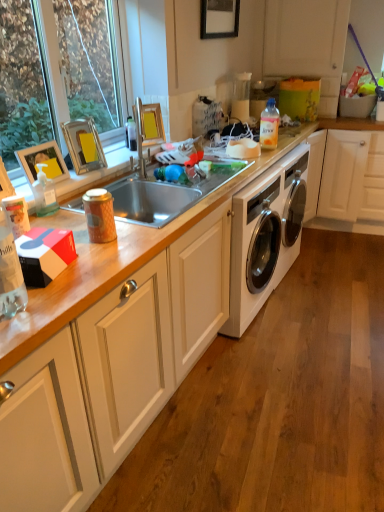
Question: Is the depth of yellow cardboard picture frame at upper center, which is counted as the 2th picture frame, starting from the right, less than that of clear glass window at upper left?

Choices:
 (A) no
 (B) yes

Answer: (A)

Question: Is yellow cardboard picture frame at upper center, acting as the second picture frame starting from the top, facing away from clear glass window at upper left?

Choices:
 (A) yes
 (B) no

Answer: (A)

Question: From a real-world perspective, is yellow cardboard picture frame at upper center, marked as the 3th picture frame in a bottom-to-top arrangement, positioned under clear glass window at upper left based on gravity?

Choices:
 (A) yes
 (B) no

Answer: (A)

Question: Does yellow cardboard picture frame at upper center, marked as the 3th picture frame in a bottom-to-top arrangement, have a lesser width compared to clear glass window at upper left?

Choices:
 (A) yes
 (B) no

Answer: (B)

Question: Is the surface of yellow cardboard picture frame at upper center, which is counted as the 2th picture frame, starting from the right, in direct contact with clear glass window at upper left?

Choices:
 (A) yes
 (B) no

Answer: (B)

Question: Is metallic silver picture frame at upper left, which is the 4th picture frame in top-to-bottom order, spatially inside black matte picture frame at upper center, the fourth picture frame in the left-to-right sequence, or outside of it?

Choices:
 (A) outside
 (B) inside

Answer: (A)

Question: Does point (56, 178) appear closer or farther from the camera than point (236, 34)?

Choices:
 (A) farther
 (B) closer

Answer: (B)

Question: Considering the positions of metallic silver picture frame at upper left, the fourth picture frame in the right-to-left sequence, and black matte picture frame at upper center, the 1th picture frame from the right, in the image, is metallic silver picture frame at upper left, the fourth picture frame in the right-to-left sequence, bigger or smaller than black matte picture frame at upper center, the 1th picture frame from the right,?

Choices:
 (A) small
 (B) big

Answer: (A)

Question: In the image, is metallic silver picture frame at upper left, marked as the first picture frame in a front-to-back arrangement, positioned in front of or behind black matte picture frame at upper center, acting as the 1th picture frame starting from the back?

Choices:
 (A) front
 (B) behind

Answer: (A)

Question: Is point [x=294, y=198] positioned closer to the camera than point [x=218, y=30]?

Choices:
 (A) farther
 (B) closer

Answer: (A)

Question: Would you say white glossy washing machine at center is inside or outside black matte picture frame at upper center, which is the 4th picture frame in front-to-back order?

Choices:
 (A) inside
 (B) outside

Answer: (B)

Question: In terms of width, does white glossy washing machine at center look wider or thinner when compared to black matte picture frame at upper center, acting as the 1th picture frame starting from the back?

Choices:
 (A) thin
 (B) wide

Answer: (B)

Question: From a real-world perspective, is white glossy washing machine at center positioned above or below black matte picture frame at upper center, the 4th picture frame ordered from the bottom?

Choices:
 (A) below
 (B) above

Answer: (A)

Question: From a real-world perspective, is white matte cabinet at upper right, positioned as the 2th cabinetry in bottom-to-top order, positioned above or below metallic silver picture frame at upper left, marked as the first picture frame in a front-to-back arrangement?

Choices:
 (A) below
 (B) above

Answer: (B)

Question: From the image's perspective, relative to metallic silver picture frame at upper left, which is the fourth picture frame from back to front, is white matte cabinet at upper right, positioned as the 2th cabinetry in bottom-to-top order, above or below?

Choices:
 (A) above
 (B) below

Answer: (A)